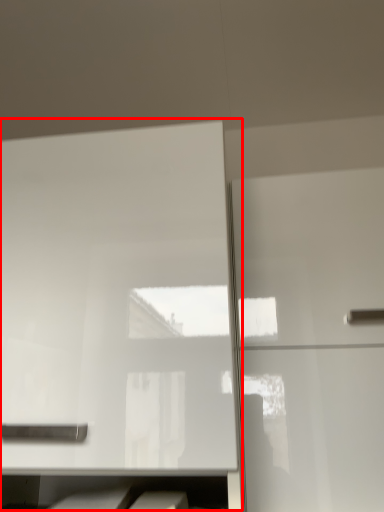
Question: From the image's perspective, what is the correct spatial positioning of cabinetry (annotated by the red box) in reference to cabinetry?

Choices:
 (A) below
 (B) above

Answer: (B)